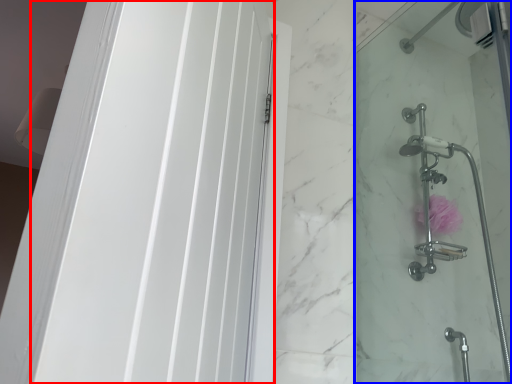
Question: Which object is closer to the camera taking this photo, screen door (highlighted by a red box) or shower door (highlighted by a blue box)?

Choices:
 (A) screen door
 (B) shower door

Answer: (A)